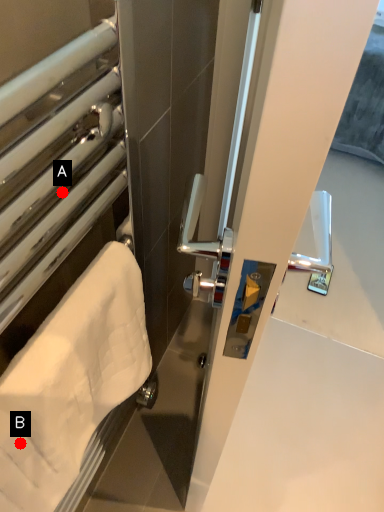
Question: Two points are circled on the image, labeled by A and B beside each circle. Which of the following is the farthest from the observer?

Choices:
 (A) A is further
 (B) B is further

Answer: (A)